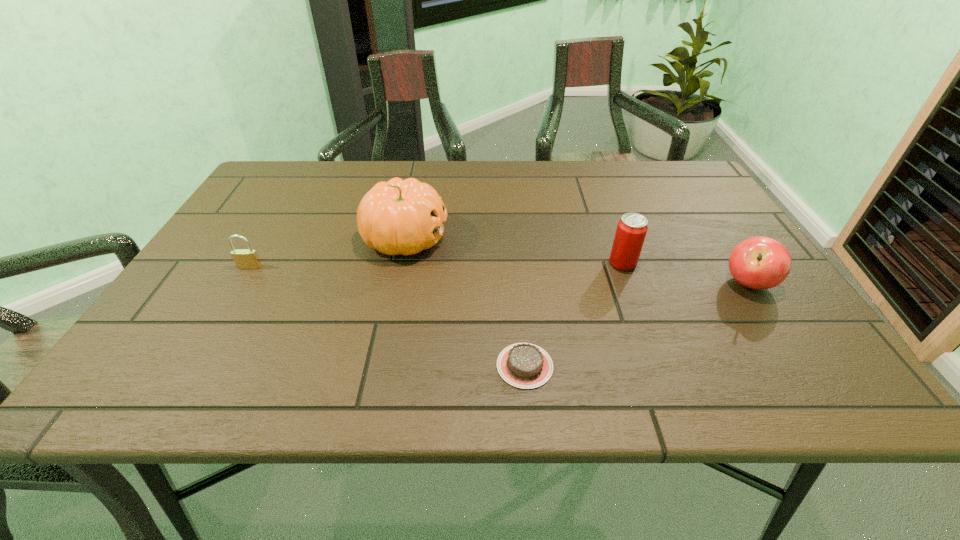
Locate an element on the screen. The height and width of the screenshot is (540, 960). the tallest object is located at coordinates (404, 217).

You are a GUI agent. You are given a task and a screenshot of the screen. Output one action in this format:
    pyautogui.click(x=<x>, y=<y>)
    Task: Click on the second object from left to right
    The height and width of the screenshot is (540, 960).
    Given the screenshot: What is the action you would take?
    pyautogui.click(x=404, y=217)

Identify the location of can. (631, 230).

Locate an element on the screen. This screenshot has width=960, height=540. the rightmost object is located at coordinates (760, 262).

The height and width of the screenshot is (540, 960). Find the location of `the leftmost object`. the leftmost object is located at coordinates (244, 258).

Locate an element on the screen. Image resolution: width=960 pixels, height=540 pixels. the second shortest object is located at coordinates (244, 258).

Where is `the nearest object`? the nearest object is located at coordinates (523, 365).

I want to click on the shortest object, so click(523, 365).

Where is `vacant space located 0.060m on the carved face of the fourth object from right to left`? This screenshot has height=540, width=960. vacant space located 0.060m on the carved face of the fourth object from right to left is located at coordinates (472, 238).

Image resolution: width=960 pixels, height=540 pixels. Find the location of `free space located 0.250m on the left of the second object from right to left`. free space located 0.250m on the left of the second object from right to left is located at coordinates (502, 263).